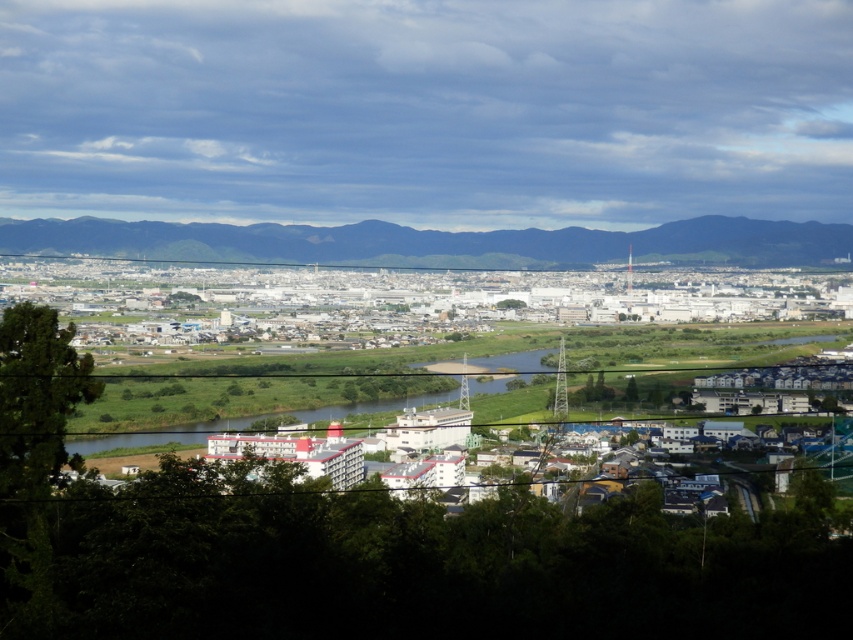
Does white industrial buildings at center appear on the right side of dark green forest at upper center?

No, white industrial buildings at center is not to the right of dark green forest at upper center.

Is point (138, 266) positioned behind point (207, 248)?

That is True.

You are a GUI agent. You are given a task and a screenshot of the screen. Output one action in this format:
    pyautogui.click(x=<x>, y=<y>)
    Task: Click on the white industrial buildings at center
    
    Given the screenshot: What is the action you would take?
    pyautogui.click(x=413, y=300)

Can you confirm if white industrial buildings at center is positioned to the left of green grassy river at center?

Incorrect, white industrial buildings at center is not on the left side of green grassy river at center.

Who is more forward, (x=578, y=308) or (x=202, y=432)?

Point (x=578, y=308) is more forward.

Locate an element on the screen. This screenshot has width=853, height=640. white industrial buildings at center is located at coordinates point(413,300).

Can you confirm if dark green forest at upper center is wider than green grassy river at center?

Correct, the width of dark green forest at upper center exceeds that of green grassy river at center.

Is dark green forest at upper center positioned behind green grassy river at center?

Yes, dark green forest at upper center is further from the viewer.

Who is more distant from viewer, (434, 257) or (474, 381)?

The point (434, 257) is behind.

You are a GUI agent. You are given a task and a screenshot of the screen. Output one action in this format:
    pyautogui.click(x=<x>, y=<y>)
    Task: Click on the dark green forest at upper center
    The height and width of the screenshot is (640, 853).
    Given the screenshot: What is the action you would take?
    pyautogui.click(x=437, y=243)